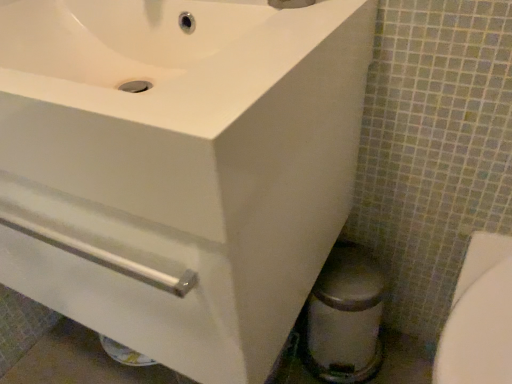
Question: From a real-world perspective, does white glossy bidet at lower right sit lower than brushed metal faucet at upper center?

Choices:
 (A) yes
 (B) no

Answer: (A)

Question: From the image's perspective, does white glossy bidet at lower right appear lower than brushed metal faucet at upper center?

Choices:
 (A) no
 (B) yes

Answer: (B)

Question: Can you confirm if white glossy bidet at lower right is shorter than brushed metal faucet at upper center?

Choices:
 (A) no
 (B) yes

Answer: (A)

Question: Considering the relative sizes of white glossy bidet at lower right and brushed metal faucet at upper center in the image provided, is white glossy bidet at lower right bigger than brushed metal faucet at upper center?

Choices:
 (A) no
 (B) yes

Answer: (B)

Question: Does white glossy bidet at lower right come in front of brushed metal faucet at upper center?

Choices:
 (A) no
 (B) yes

Answer: (B)

Question: Is white glossy bidet at lower right not close to brushed metal faucet at upper center?

Choices:
 (A) no
 (B) yes

Answer: (A)

Question: Is white glossy sink at upper left completely or partially inside white glossy bidet at lower right?

Choices:
 (A) no
 (B) yes

Answer: (A)

Question: From the image's perspective, is white glossy bidet at lower right beneath white glossy sink at upper left?

Choices:
 (A) yes
 (B) no

Answer: (A)

Question: Considering the relative sizes of white glossy bidet at lower right and white glossy sink at upper left in the image provided, is white glossy bidet at lower right thinner than white glossy sink at upper left?

Choices:
 (A) no
 (B) yes

Answer: (B)

Question: From a real-world perspective, is white glossy bidet at lower right located higher than white glossy sink at upper left?

Choices:
 (A) yes
 (B) no

Answer: (B)

Question: Is white glossy bidet at lower right directly adjacent to white glossy sink at upper left?

Choices:
 (A) no
 (B) yes

Answer: (A)

Question: Is white glossy bidet at lower right taller than white glossy sink at upper left?

Choices:
 (A) no
 (B) yes

Answer: (B)

Question: Is white glossy sink at upper left facing towards white glossy bidet at lower right?

Choices:
 (A) yes
 (B) no

Answer: (B)